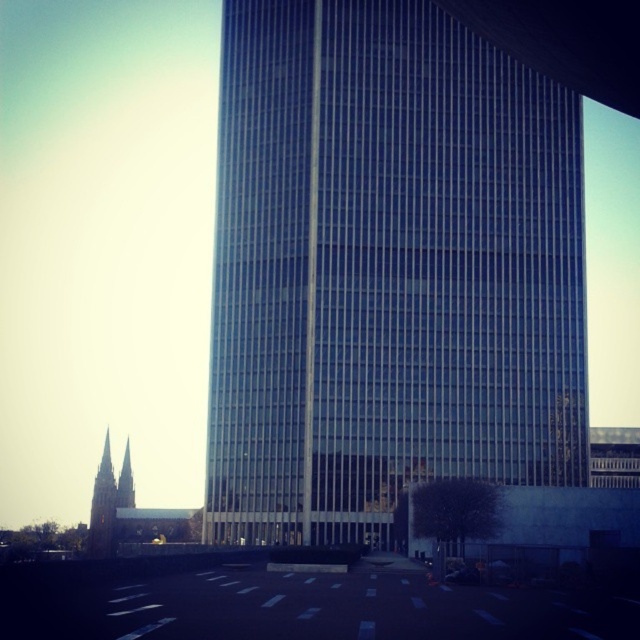
Question: Is transparent glass tower at center above golden stone spire at left?

Choices:
 (A) no
 (B) yes

Answer: (B)

Question: Which point is closer to the camera?

Choices:
 (A) (292, 164)
 (B) (125, 492)

Answer: (A)

Question: Is transparent glass tower at center positioned before golden stone spire at left?

Choices:
 (A) yes
 (B) no

Answer: (A)

Question: Does transparent glass tower at center have a lesser width compared to golden stone spire at left?

Choices:
 (A) no
 (B) yes

Answer: (A)